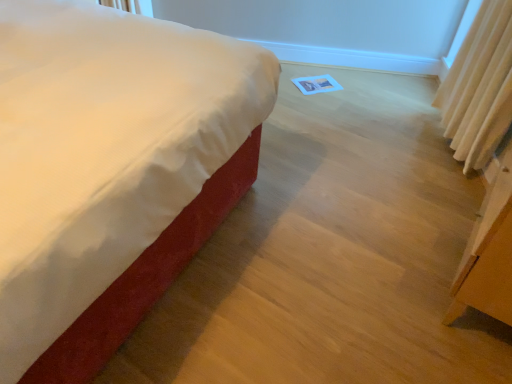
Question: Would you say satin white bed at center is to the left or to the right of beige fabric curtain at right in the picture?

Choices:
 (A) left
 (B) right

Answer: (A)

Question: Is point [266, 105] closer or farther from the camera than point [493, 120]?

Choices:
 (A) closer
 (B) farther

Answer: (A)

Question: From the image's perspective, is satin white bed at center above or below beige fabric curtain at right?

Choices:
 (A) above
 (B) below

Answer: (B)

Question: Is beige fabric curtain at right spatially inside satin white bed at center, or outside of it?

Choices:
 (A) outside
 (B) inside

Answer: (A)

Question: Considering the relative positions of beige fabric curtain at right and satin white bed at center in the image provided, is beige fabric curtain at right to the left or to the right of satin white bed at center?

Choices:
 (A) left
 (B) right

Answer: (B)

Question: From a real-world perspective, is beige fabric curtain at right physically located above or below satin white bed at center?

Choices:
 (A) above
 (B) below

Answer: (B)

Question: Is point (486, 61) positioned closer to the camera than point (202, 148)?

Choices:
 (A) closer
 (B) farther

Answer: (B)